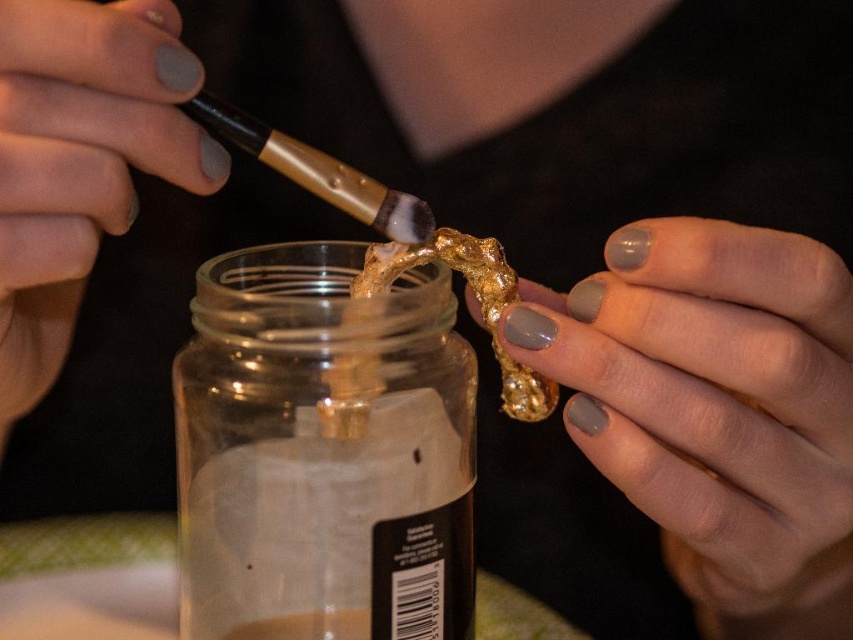
You are an artist trying to apply the gold leaf at center to the transparent glass jar at center. Which object should you move first to ensure proper application?

The transparent glass jar at center is positioned on the left side of gold leaf at center. To apply the gold leaf at center to the jar, you should move the gold leaf at center first so it can be properly positioned over the jar.

You are a craftsperson working on a project and need to place a new tool exactly at the location of the matte gray nail polish at upper left. What are the coordinates where you should place it?

The coordinates for the matte gray nail polish at upper left are at point (80, 161).